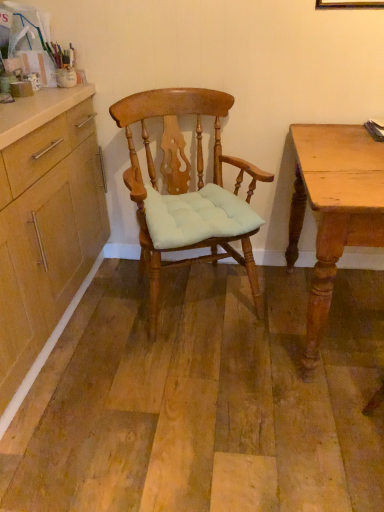
Measure the distance between point [326,292] and camera.

Point [326,292] and camera are 4.51 feet apart.

What do you see at coordinates (334, 209) in the screenshot? This screenshot has height=512, width=384. I see `light brown wooden desk at right` at bounding box center [334, 209].

This screenshot has width=384, height=512. I want to click on light brown wooden desk at right, so click(x=334, y=209).

Describe the element at coordinates (197, 177) in the screenshot. The image size is (384, 512). I see `matte wood chair at center` at that location.

This screenshot has height=512, width=384. I want to click on matte wood chair at center, so click(197, 177).

Locate an element on the screen. light brown wooden desk at right is located at coordinates (x=334, y=209).

Considering the relative positions of matte wood chair at center and light brown wooden desk at right in the image provided, is matte wood chair at center to the right of light brown wooden desk at right from the viewer's perspective?

Incorrect, matte wood chair at center is not on the right side of light brown wooden desk at right.

Is matte wood chair at center in front of light brown wooden desk at right?

No, matte wood chair at center is further to the viewer.

Considering the positions of points (240, 163) and (365, 194), is point (240, 163) farther from camera compared to point (365, 194)?

Yes.

From the image's perspective, which one is positioned higher, matte wood chair at center or light brown wooden desk at right?

matte wood chair at center, from the image's perspective.

From a real-world perspective, who is located lower, matte wood chair at center or light brown wooden desk at right?

light brown wooden desk at right, from a real-world perspective.

Can you confirm if matte wood chair at center is thinner than light brown wooden desk at right?

Indeed, matte wood chair at center has a lesser width compared to light brown wooden desk at right.

Is matte wood chair at center taller than light brown wooden desk at right?

Indeed, matte wood chair at center has a greater height compared to light brown wooden desk at right.

Considering the sizes of objects matte wood chair at center and light brown wooden desk at right in the image provided, who is bigger, matte wood chair at center or light brown wooden desk at right?

light brown wooden desk at right is bigger.

Choose the correct answer: Is matte wood chair at center inside light brown wooden desk at right or outside it?

matte wood chair at center cannot be found inside light brown wooden desk at right.

Is matte wood chair at center touching light brown wooden desk at right?

No, matte wood chair at center is not touching light brown wooden desk at right.

Is matte wood chair at center positioned with its back to light brown wooden desk at right?

No, matte wood chair at center is not facing the opposite direction of light brown wooden desk at right.

How many degrees apart are the facing directions of matte wood chair at center and light brown wooden desk at right?

Result: The angular difference between matte wood chair at center and light brown wooden desk at right is 24.7 degrees.

I want to click on desk that appears below the matte wood chair at center (from the image's perspective), so click(334, 209).

In the image, is light brown wooden desk at right on the left side or the right side of matte wood chair at center?

Based on their positions, light brown wooden desk at right is located to the right of matte wood chair at center.

Who is more distant, light brown wooden desk at right or matte wood chair at center?

matte wood chair at center is more distant.

Considering the positions of points (329, 301) and (211, 109), is point (329, 301) farther from camera compared to point (211, 109)?

No, it is not.

From the image's perspective, is light brown wooden desk at right above or below matte wood chair at center?

light brown wooden desk at right is situated lower than matte wood chair at center in the image.

From a real-world perspective, is light brown wooden desk at right physically below matte wood chair at center?

Indeed, from a real-world perspective, light brown wooden desk at right is positioned beneath matte wood chair at center.

Between light brown wooden desk at right and matte wood chair at center, which one has smaller width?

Thinner between the two is matte wood chair at center.

Who is taller, light brown wooden desk at right or matte wood chair at center?

matte wood chair at center.

Does light brown wooden desk at right have a smaller size compared to matte wood chair at center?

No, light brown wooden desk at right is not smaller than matte wood chair at center.

Do you think light brown wooden desk at right is within matte wood chair at center, or outside of it?

light brown wooden desk at right is not enclosed by matte wood chair at center.

Is light brown wooden desk at right not near matte wood chair at center?

light brown wooden desk at right is near matte wood chair at center, not far away.

Is light brown wooden desk at right looking in the opposite direction of matte wood chair at center?

No, light brown wooden desk at right's orientation is not away from matte wood chair at center.

How many degrees apart are the facing directions of light brown wooden desk at right and matte wood chair at center?

light brown wooden desk at right and matte wood chair at center are facing 24.7 degrees away from each other.

Where is `desk in front of the matte wood chair at center`? This screenshot has height=512, width=384. desk in front of the matte wood chair at center is located at coordinates (334, 209).

Find the location of a particular element. chair that appears on the left of light brown wooden desk at right is located at coordinates point(197,177).

Locate an element on the screen. desk below the matte wood chair at center (from the image's perspective) is located at coordinates (334, 209).